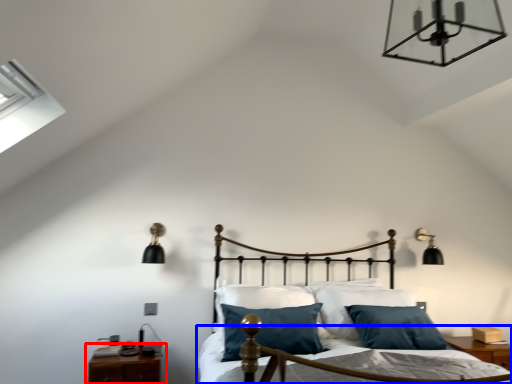
Question: Which object is further to the camera taking this photo, nightstand (highlighted by a red box) or bed frame (highlighted by a blue box)?

Choices:
 (A) nightstand
 (B) bed frame

Answer: (A)